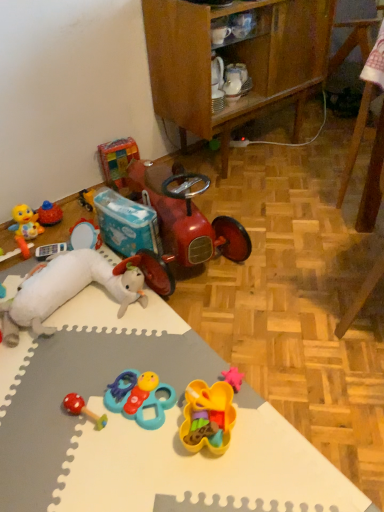
Find the location of a particular element. Image resolution: width=384 pixels, height=512 pixels. vacant space that is to the left of rubberized red mushroom rattle at lower left, the 2th toy in the front-to-back sequence is located at coordinates (35, 420).